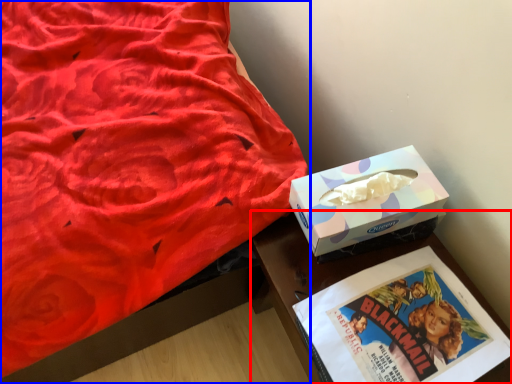
Question: Which point is closer to the camera, table (highlighted by a red box) or bed (highlighted by a blue box)?

Choices:
 (A) table
 (B) bed

Answer: (B)